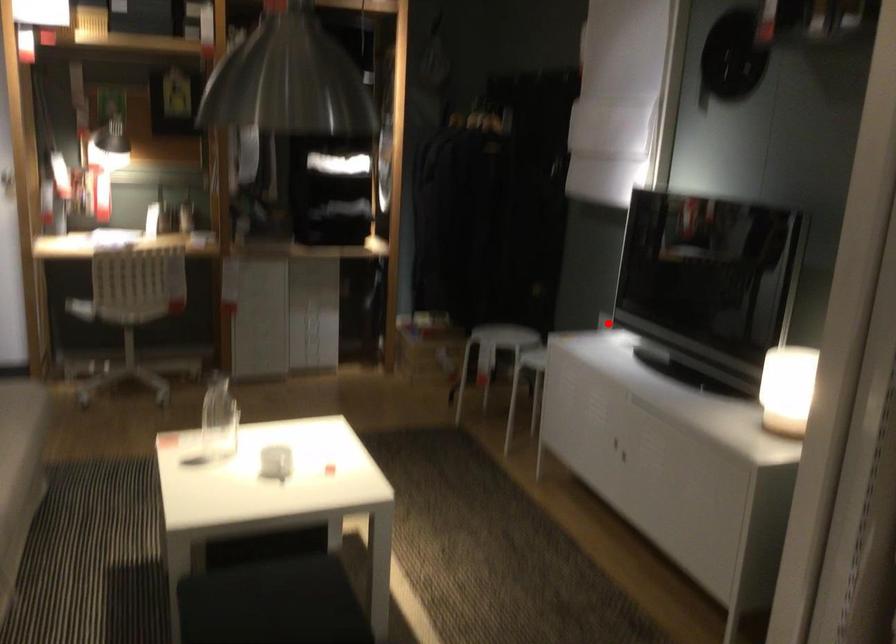
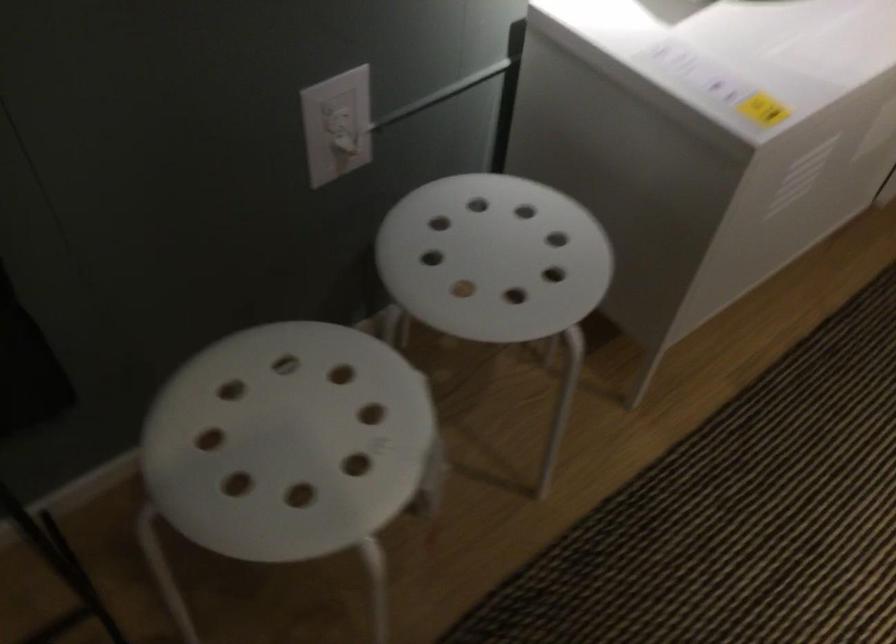
Question: I am providing you with two images of the same scene from different viewpoints. Image1 has a red point marked. In image2, the corresponding 3D location appears at what relative position? Reply with the corresponding letter.

Choices:
 (A) Closer
 (B) Farther

Answer: (A)